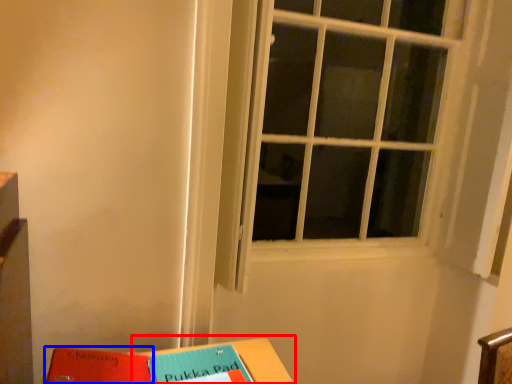
Question: Which object is closer to the camera taking this photo, table (highlighted by a red box) or paperback book (highlighted by a blue box)?

Choices:
 (A) table
 (B) paperback book

Answer: (A)